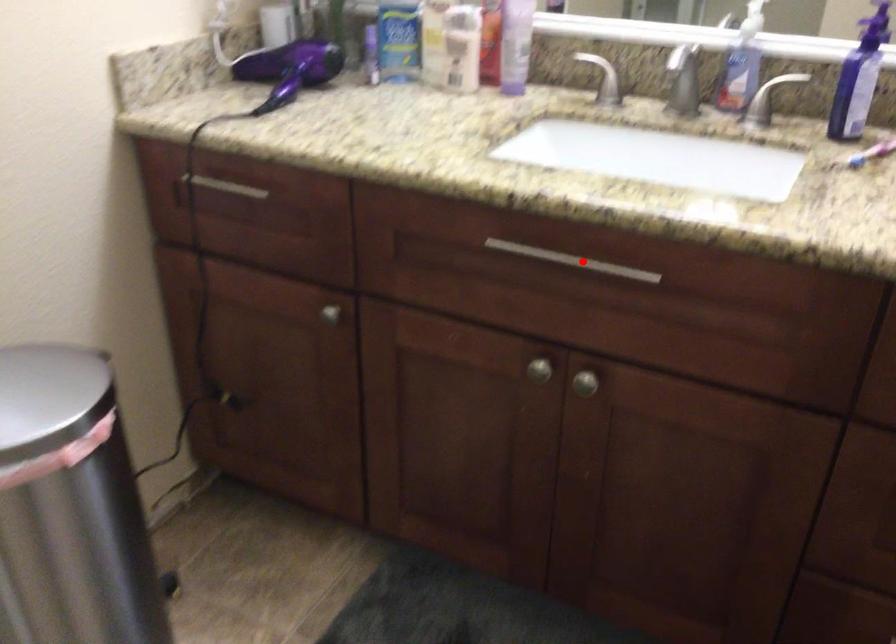
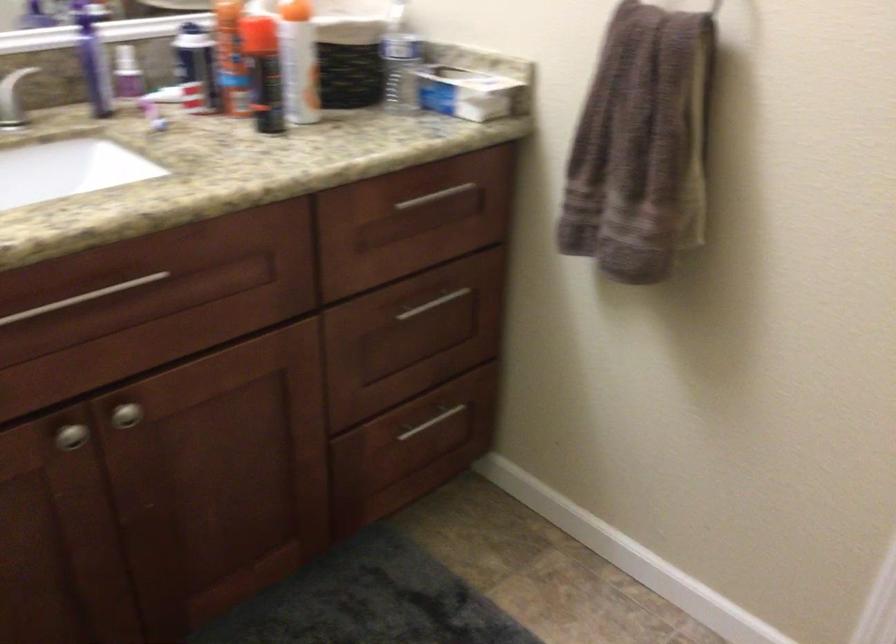
Question: I am providing you with two images of the same scene from different viewpoints. A red point is shown in image1. For the corresponding object point in image2, is it positioned nearer or farther from the camera?

Choices:
 (A) Nearer
 (B) Farther

Answer: (A)